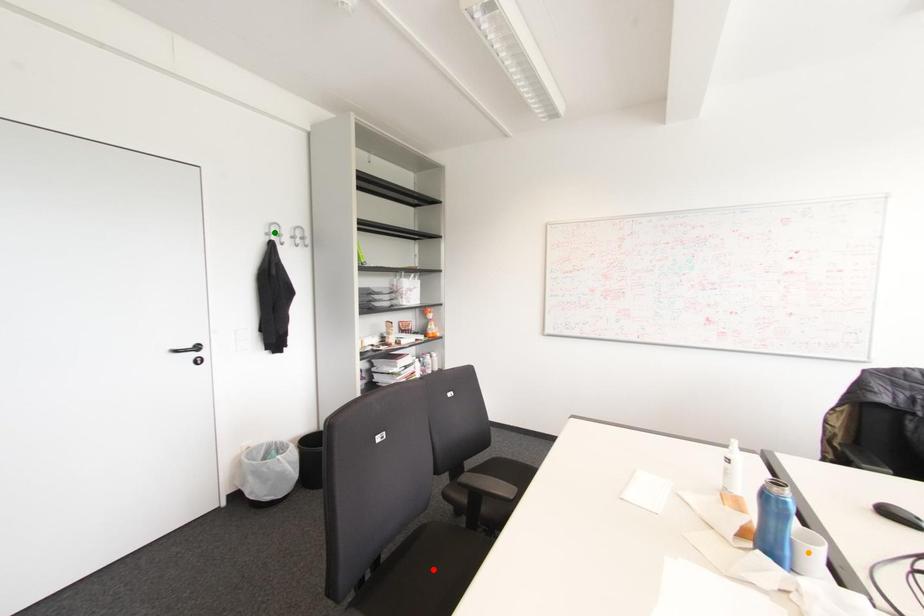
Order these from farthest to nearest:
- orange point
- green point
- red point

green point < red point < orange point